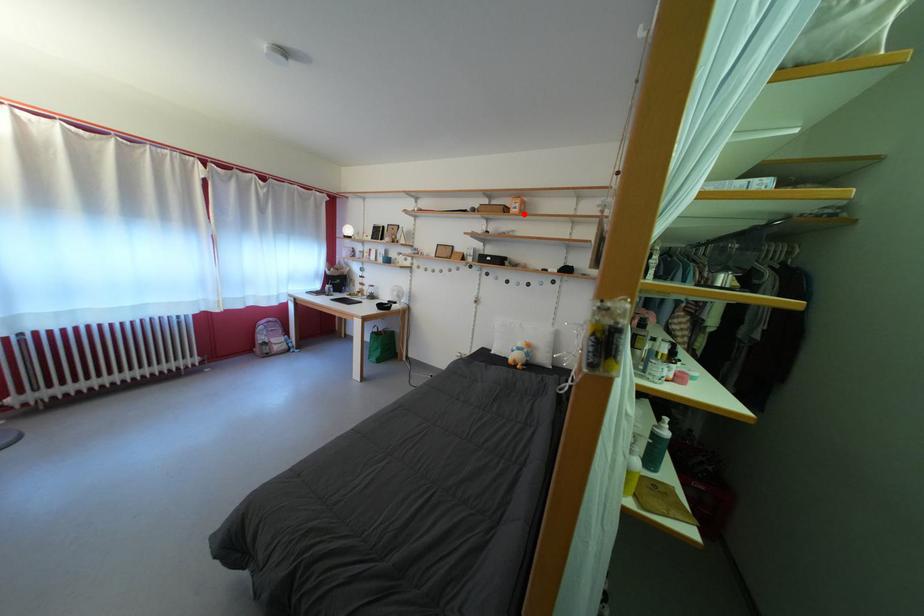
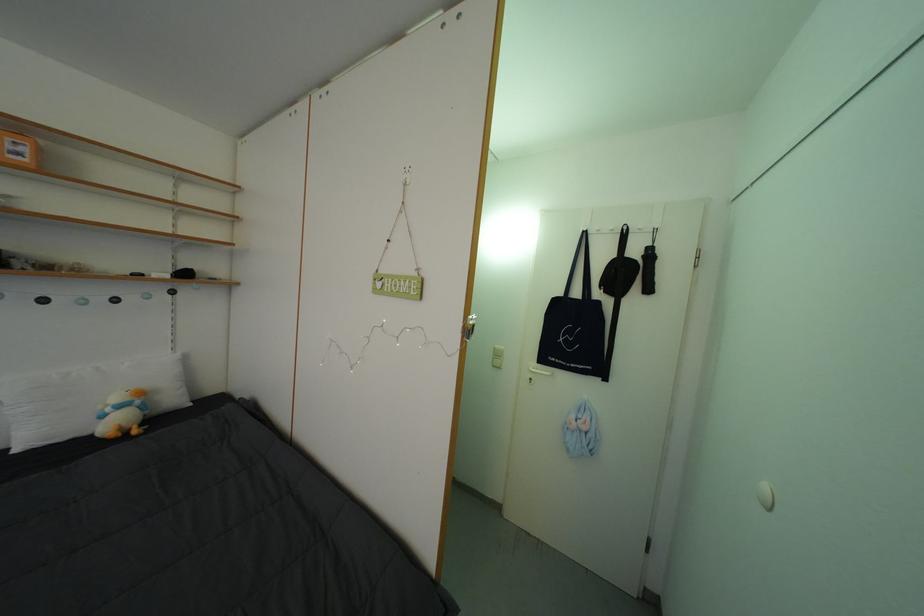
Locate, in the second image, the point that corresponds to the highlighted location in the first image.

(27, 160)